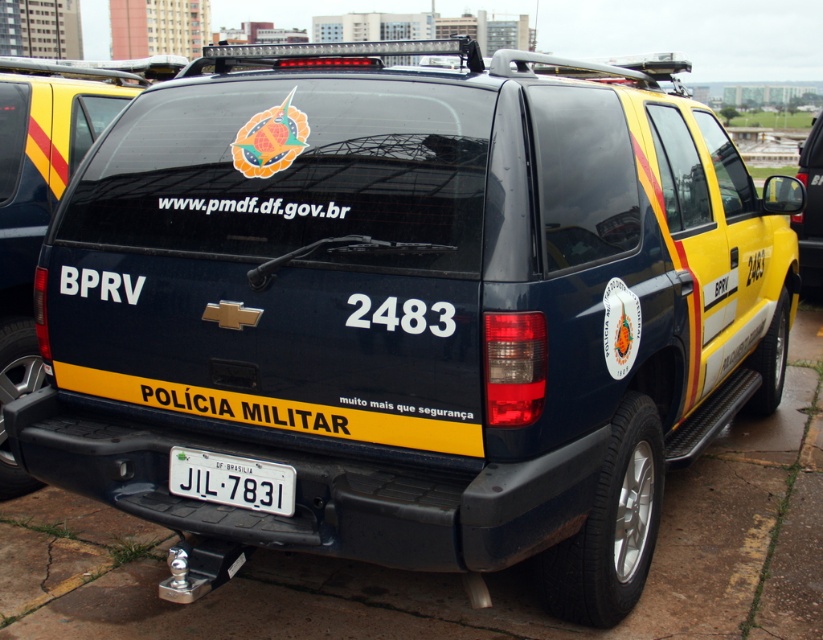
Question: Among these objects, which one is nearest to the camera?

Choices:
 (A) white plastic license plate at center
 (B) matte black suv at center

Answer: (A)

Question: Which of the following is the farthest from the observer?

Choices:
 (A) (819, 248)
 (B) (281, 465)
 (C) (61, 129)

Answer: (A)

Question: Is matte black suv at center to the right of white plastic license plate at center from the viewer's perspective?

Choices:
 (A) no
 (B) yes

Answer: (A)

Question: Is white plastic license plate at center to the left of yellow matte suv at right from the viewer's perspective?

Choices:
 (A) no
 (B) yes

Answer: (B)

Question: Which object is closer to the camera taking this photo?

Choices:
 (A) matte black suv at center
 (B) yellow matte suv at right
 (C) white plastic license plate at center

Answer: (C)

Question: Observing the image, what is the correct spatial positioning of white plastic license plate at center in reference to yellow matte suv at right?

Choices:
 (A) left
 (B) right

Answer: (A)